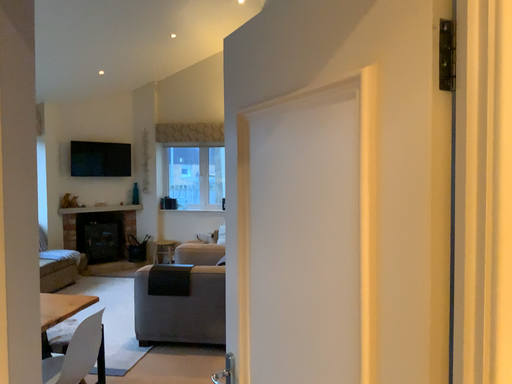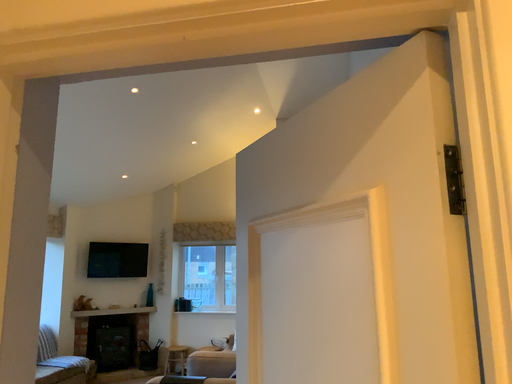
Question: Which way did the camera rotate in the video?

Choices:
 (A) rotated upward
 (B) rotated downward

Answer: (A)